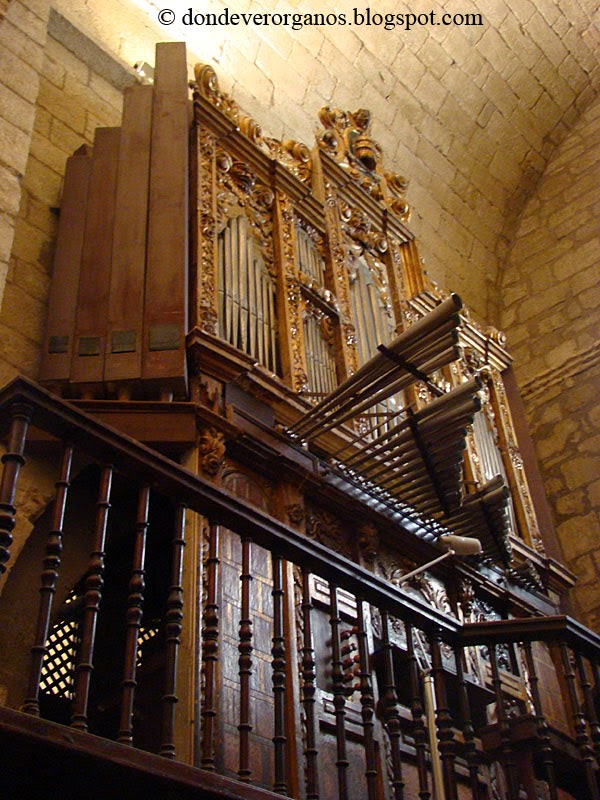
Identify the location of brick wall. The width and height of the screenshot is (600, 800). (565, 276).